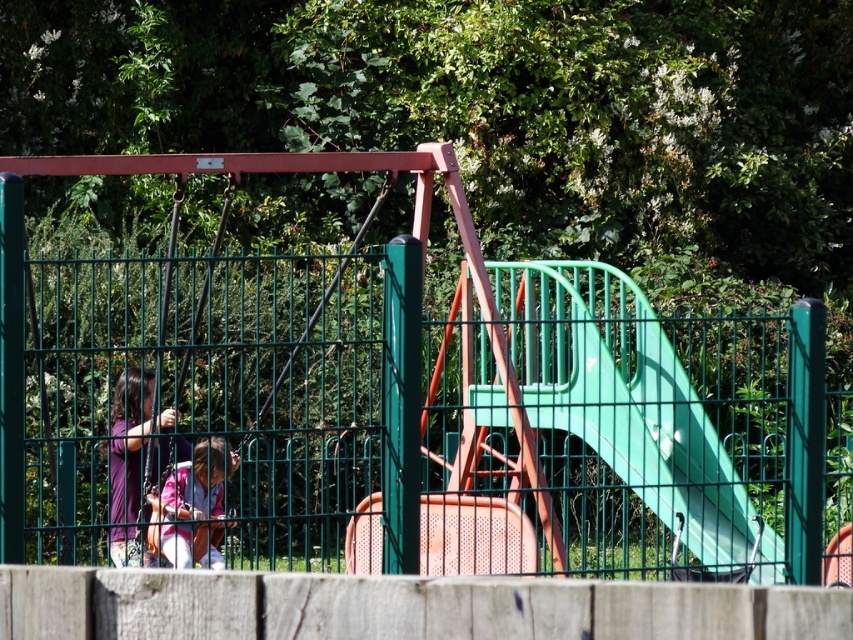
You are a parent trying to locate your child who is playing on either the green plastic slide at center or the metallic swing at left. According to the scene, which equipment is closer to the right side of the playground?

The green plastic slide at center is positioned on the right side of the metallic swing at left, so the green plastic slide at center is closer to the right side of the playground.

You are a parent trying to guide your child to the green plastic slide at center from the metallic swing at left. Which direction should you tell your child to go?

The green plastic slide at center is below the metallic swing at left, so the child should move downward from the metallic swing at left to reach the green plastic slide at center.